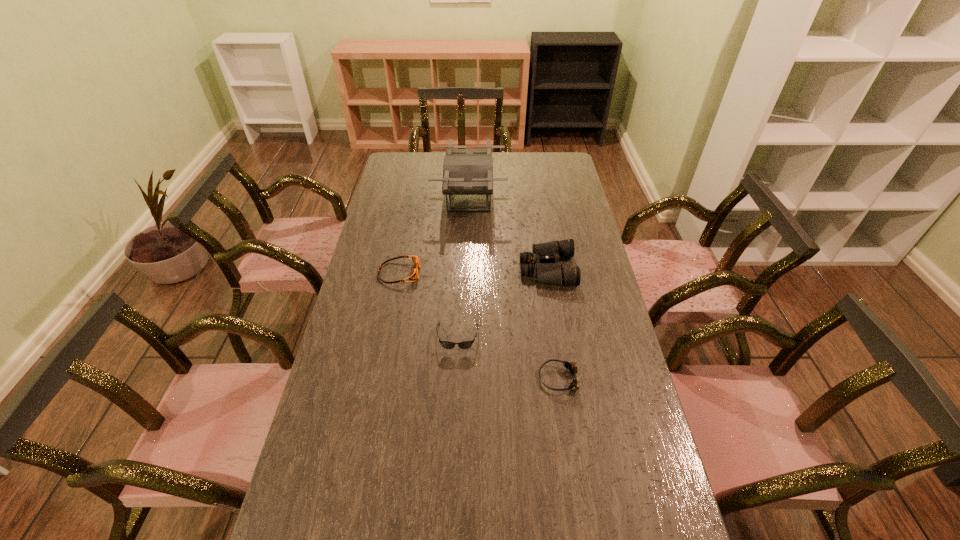
The width and height of the screenshot is (960, 540). What are the coordinates of `goggles that is at the right edge` in the screenshot? It's located at (570, 366).

In the image, there is a desktop. What are the coordinates of `free space at the far edge` in the screenshot? It's located at (508, 153).

In the image, there is a desktop. Where is `free region at the left edge`? The width and height of the screenshot is (960, 540). free region at the left edge is located at coordinates (384, 209).

Find the location of a particular element. This screenshot has width=960, height=540. vacant space at the right edge is located at coordinates (545, 192).

You are a GUI agent. You are given a task and a screenshot of the screen. Output one action in this format:
    pyautogui.click(x=<x>, y=<y>)
    Task: Click on the free spot at the far right corner of the desktop
    Image resolution: width=960 pixels, height=540 pixels.
    Given the screenshot: What is the action you would take?
    pyautogui.click(x=557, y=167)

You are a GUI agent. You are given a task and a screenshot of the screen. Output one action in this format:
    pyautogui.click(x=<x>, y=<y>)
    Task: Click on the unoccupied area between the drone and the second nearest object
    The image size is (960, 540).
    Given the screenshot: What is the action you would take?
    pyautogui.click(x=464, y=267)

The image size is (960, 540). Identify the location of unoccupied area between the second tallest object and the fourth farthest object. (502, 303).

The image size is (960, 540). Find the location of `free spot between the fourth shortest object and the right goggles`. free spot between the fourth shortest object and the right goggles is located at coordinates (553, 323).

I want to click on free space between the drone and the second nearest object, so click(x=464, y=267).

I want to click on free spot between the sunglasses and the nearer goggles, so click(x=509, y=358).